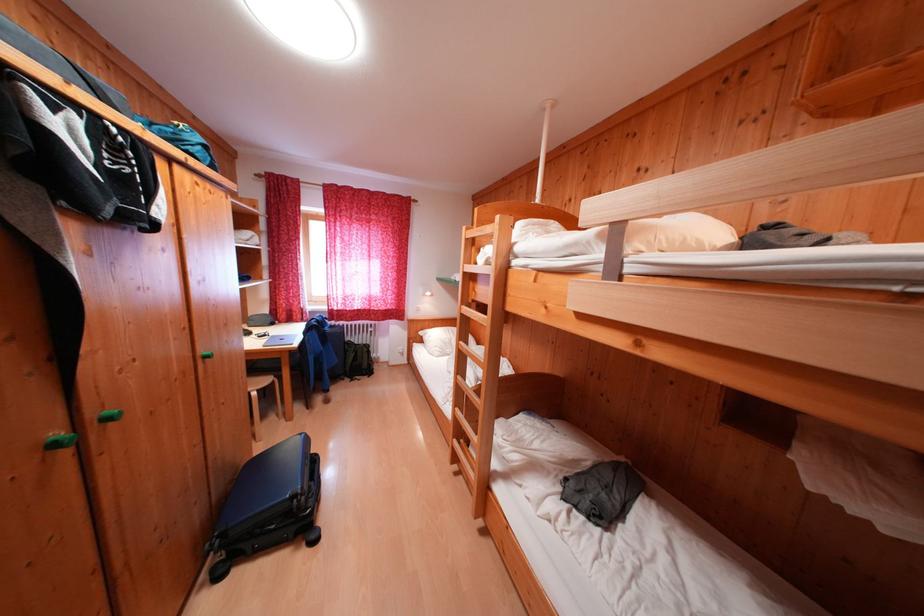
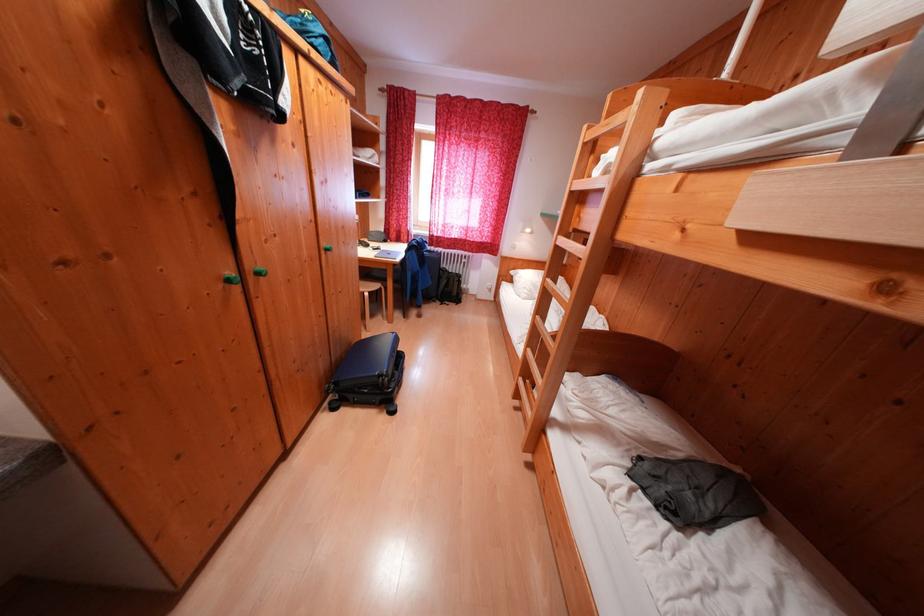
Where in the second image is the point corresponding to point 430,345 from the first image?

(518, 284)